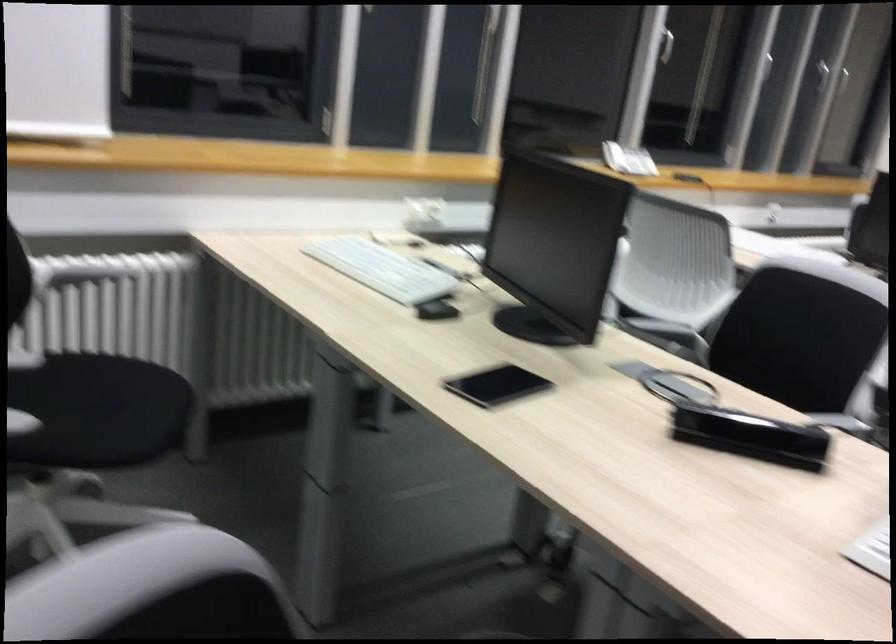
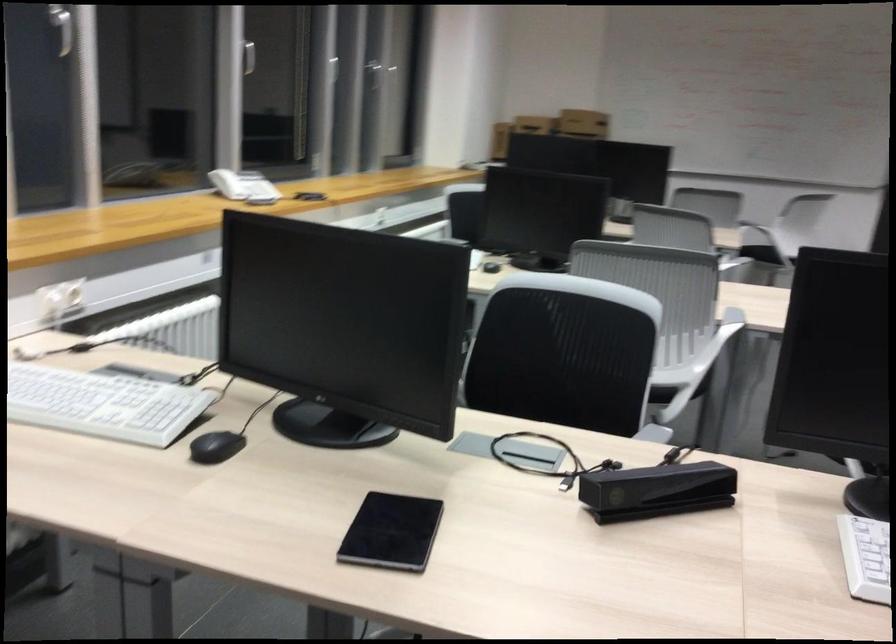
The point at (812, 336) is marked in the first image. Where is the corresponding point in the second image?

(564, 353)